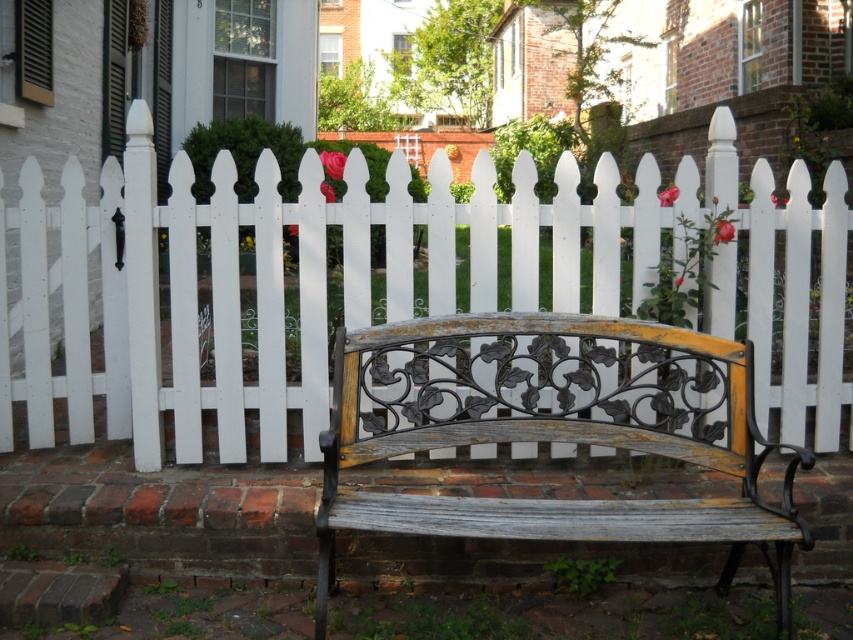
Question: Among these objects, which one is farthest from the camera?

Choices:
 (A) distressed wood bench at center
 (B) white picket fence at center

Answer: (B)

Question: Is white picket fence at center to the left of distressed wood bench at center from the viewer's perspective?

Choices:
 (A) no
 (B) yes

Answer: (B)

Question: Does white picket fence at center have a greater width compared to distressed wood bench at center?

Choices:
 (A) no
 (B) yes

Answer: (B)

Question: In this image, where is white picket fence at center located relative to distressed wood bench at center?

Choices:
 (A) below
 (B) above

Answer: (B)

Question: Which point is farther from the camera taking this photo?

Choices:
 (A) (828, 316)
 (B) (532, 428)

Answer: (A)